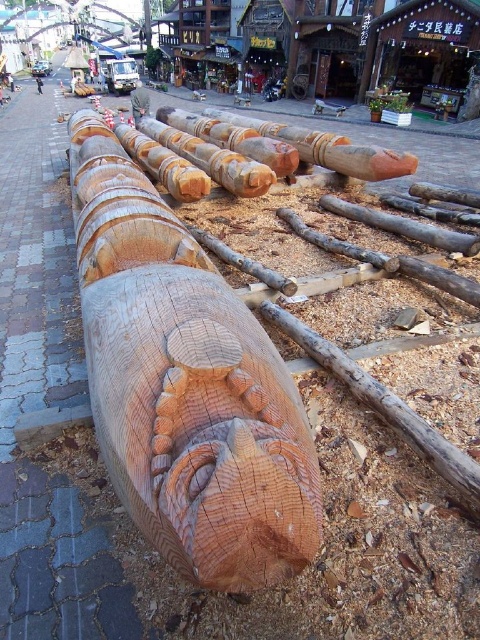
You are standing at the viewpoint of the image and want to walk towards the point labeled as point (x=304, y=522). Which direction should you move relative to point (x=147, y=64)?

You should move towards point (x=304, y=522) which is in front of point (x=147, y=64), so walk in the direction of point (x=304, y=522).

You are standing at the edge of a market area and see the natural wood carving at center and the smooth brown tree trunk at center. Which object is farther away from you?

The natural wood carving at center is 149.71 feet away from the smooth brown tree trunk at center, so the natural wood carving at center is farther away from you than the smooth brown tree trunk at center.